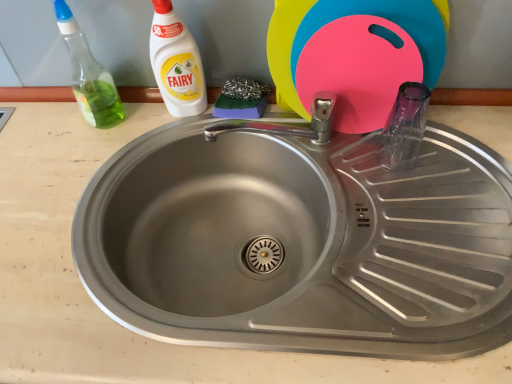
Identify the location of free space above stainless steel sink at center (from a real-world perspective). Image resolution: width=512 pixels, height=384 pixels. (335, 186).